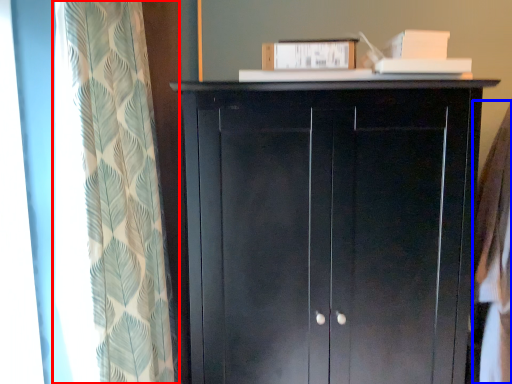
Question: Which object is further to the camera taking this photo, curtain (highlighted by a red box) or clothing (highlighted by a blue box)?

Choices:
 (A) curtain
 (B) clothing

Answer: (B)